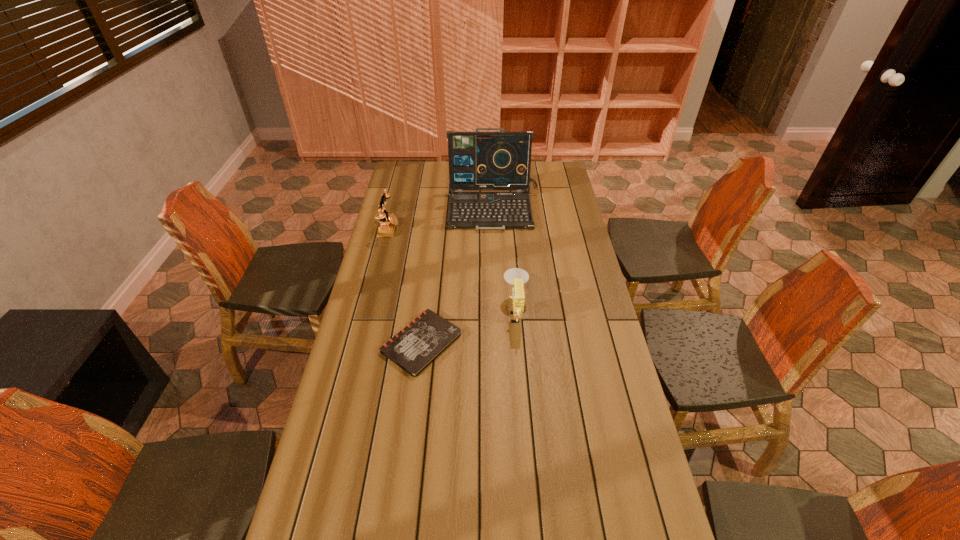
The image size is (960, 540). In order to click on laptop computer in this screenshot , I will do `click(477, 160)`.

Find the location of `the leftmost object`. the leftmost object is located at coordinates (386, 228).

What are the coordinates of `sponge` in the screenshot? It's located at (517, 277).

Where is `notebook`? notebook is located at coordinates (426, 337).

Identify the location of vacant space situated 0.180m on the front-facing side of the tallest object. (495, 258).

You are a GUI agent. You are given a task and a screenshot of the screen. Output one action in this format:
    pyautogui.click(x=<x>, y=<y>)
    Task: Click on the free space located 0.290m on the dial of the leftmost object
    
    Given the screenshot: What is the action you would take?
    pyautogui.click(x=463, y=228)

At what (x,y) coordinates should I click in order to perform the action: click on vacant space situated on the front-facing side of the sponge. Please return your answer as a coordinate pair (x, y). Looking at the image, I should click on (413, 311).

This screenshot has height=540, width=960. I want to click on vacant area located 0.150m on the front-facing side of the sponge, so click(463, 311).

Where is `vacant area situated on the front-facing side of the sponge`? This screenshot has height=540, width=960. vacant area situated on the front-facing side of the sponge is located at coordinates (460, 311).

The image size is (960, 540). Find the location of `free point located 0.270m on the back of the notebook`. free point located 0.270m on the back of the notebook is located at coordinates (431, 264).